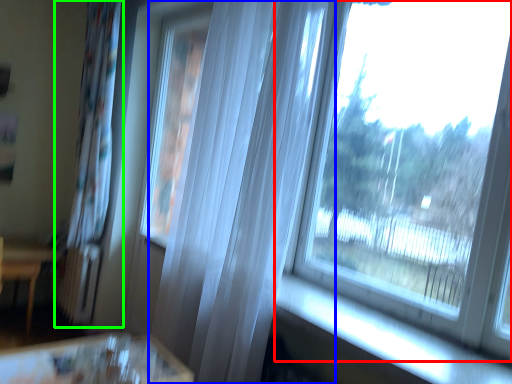
Question: Which object is the farthest from window (highlighted by a red box)? Choose among these: curtain (highlighted by a blue box) or curtain (highlighted by a green box).

Choices:
 (A) curtain
 (B) curtain

Answer: (B)